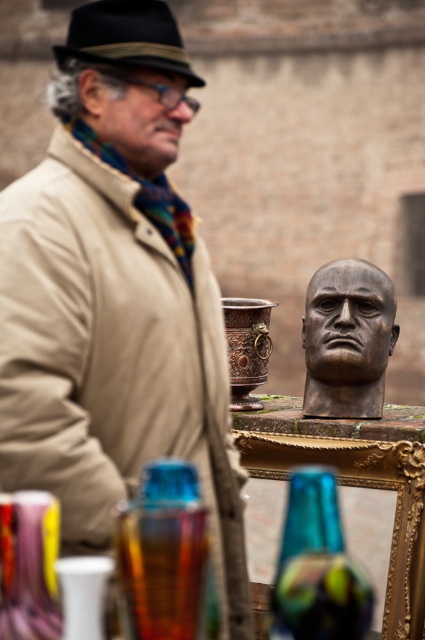
You are a customer at the market and want to buy both the translucent iridescent vase at center and the matte brown wooden head at center. You need to know their arrangement to decide how to carry them. Which object is on the right side?

The translucent iridescent vase at center is positioned on the right side of the matte brown wooden head at center.

You are a customer at the market who wants to buy a tall decorative item. You see the translucent iridescent vase at center and the copper metallic pot at center. Which one should you choose if you want the taller one?

The translucent iridescent vase at center is taller than the copper metallic pot at center, so you should choose the translucent iridescent vase at center.

You are a customer at the market and want to place a small potted plant on the table. The potted plant requires a spot that is not directly under the translucent iridescent vase at center. Where on the table should you place it?

The translucent iridescent vase at center is located at point (317,566). To avoid placing the potted plant directly under it, choose a spot on the table that is not at those coordinates.